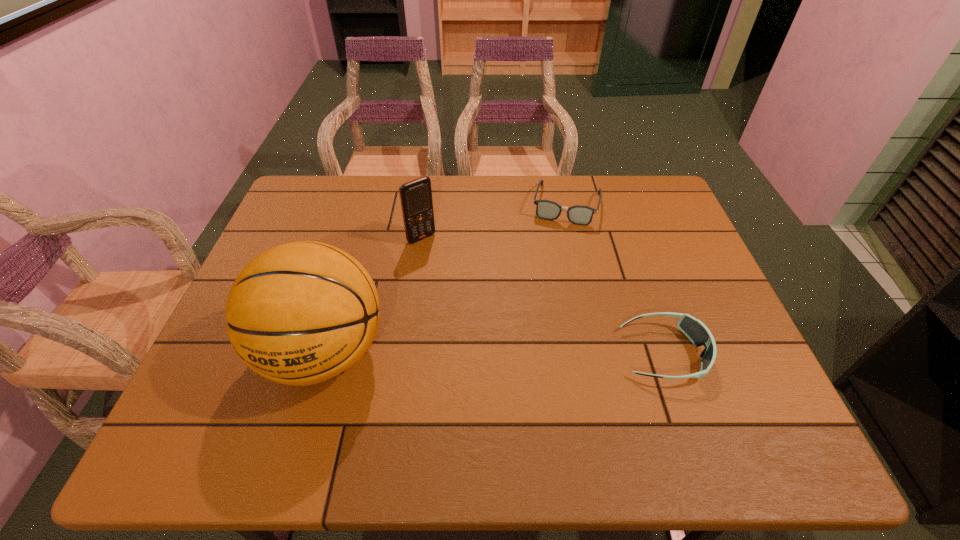
This screenshot has height=540, width=960. Find the location of `vacant space located 0.350m on the face of the farthest object`. vacant space located 0.350m on the face of the farthest object is located at coordinates (541, 314).

Image resolution: width=960 pixels, height=540 pixels. I want to click on vacant space located 0.180m on the face of the farthest object, so [552, 267].

Where is `object positioned at the far edge`? Image resolution: width=960 pixels, height=540 pixels. object positioned at the far edge is located at coordinates (581, 215).

Find the location of `basketball present at the near edge`. basketball present at the near edge is located at coordinates tap(302, 313).

At what (x,y) coordinates should I click in order to perform the action: click on goggles at the near edge. Please return your answer as a coordinate pair (x, y). This screenshot has width=960, height=540. Looking at the image, I should click on (694, 329).

Find the location of a particular element. object present at the left edge is located at coordinates (302, 313).

At what (x,y) coordinates should I click in order to perform the action: click on object located at the right edge. Please return your answer as a coordinate pair (x, y). The image size is (960, 540). Looking at the image, I should click on (694, 329).

What are the coordinates of `object that is at the near left corner` in the screenshot? It's located at (302, 313).

Find the location of `object present at the near right corner`. object present at the near right corner is located at coordinates (694, 329).

Image resolution: width=960 pixels, height=540 pixels. I want to click on free space at the far edge of the desktop, so click(x=567, y=179).